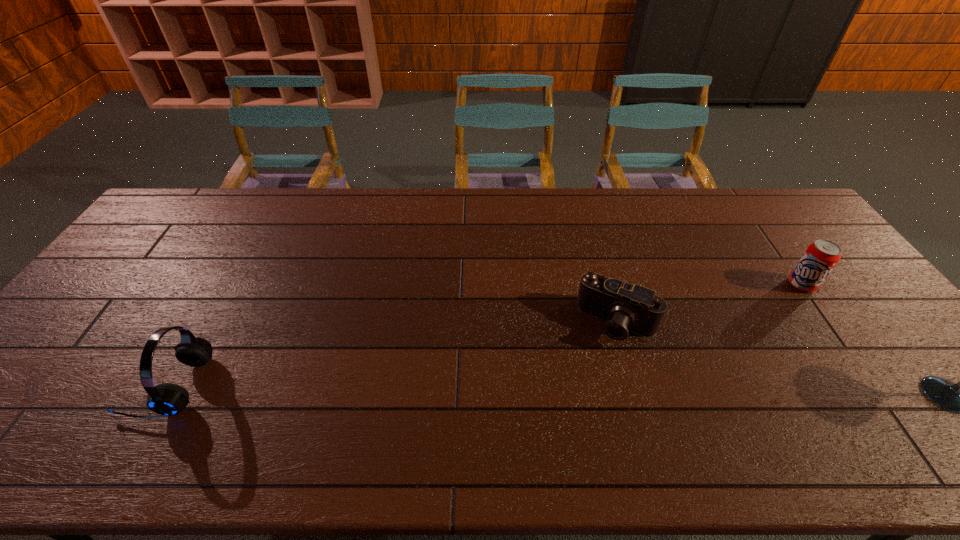
Locate an element on the screen. The height and width of the screenshot is (540, 960). free space at the right edge of the desktop is located at coordinates (879, 363).

The image size is (960, 540). In the image, there is a desktop. In order to click on vacant space at the far left corner in this screenshot , I will do `click(180, 189)`.

Locate an element on the screen. The height and width of the screenshot is (540, 960). vacant space at the near right corner of the desktop is located at coordinates (889, 401).

Where is `free space between the leftmost object and the third object from left to right`? The width and height of the screenshot is (960, 540). free space between the leftmost object and the third object from left to right is located at coordinates (485, 335).

Image resolution: width=960 pixels, height=540 pixels. I want to click on empty location between the headset and the camera, so click(393, 354).

I want to click on vacant space in between the second tallest object and the shortest object, so click(393, 354).

What are the coordinates of `free space between the second object from left to right and the headset` in the screenshot? It's located at [393, 354].

This screenshot has height=540, width=960. Find the location of `empty location between the third shortest object and the third object from right to left`. empty location between the third shortest object and the third object from right to left is located at coordinates (393, 354).

Identify which object is the nearest to the third nearest object. Please provide its 2D coordinates. Your answer should be formatted as a tuple, i.e. [(x, y)], where the tuple contains the x and y coordinates of a point satisfying the conditions above.

[(820, 257)]

The height and width of the screenshot is (540, 960). What are the coordinates of `object that can be found as the second closest to the rightmost object` in the screenshot? It's located at (623, 306).